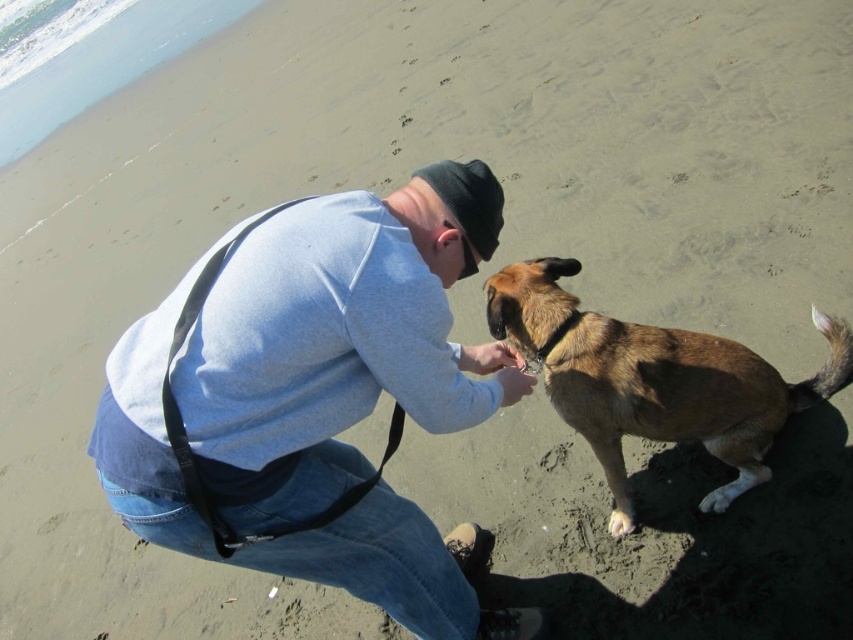
Question: Considering the relative positions of light blue sweater at center and brown fur dog at lower right in the image provided, where is light blue sweater at center located with respect to brown fur dog at lower right?

Choices:
 (A) below
 (B) above

Answer: (B)

Question: Estimate the real-world distances between objects in this image. Which object is farther from the brown fur dog at lower right?

Choices:
 (A) light blue sweater at center
 (B) white fur paw at lower right

Answer: (A)

Question: Which point is farther to the camera?

Choices:
 (A) (616, 536)
 (B) (383, 232)
 (C) (770, 474)

Answer: (A)

Question: Does brown fur dog at lower right have a smaller size compared to white fur paw at lower right?

Choices:
 (A) no
 (B) yes

Answer: (A)

Question: Is light blue sweater at center wider than brown fur dog at lower right?

Choices:
 (A) yes
 (B) no

Answer: (B)

Question: Which object is farther from the camera taking this photo?

Choices:
 (A) light blue sweater at center
 (B) brown fur dog at lower right
 (C) white fur paw at lower right

Answer: (C)